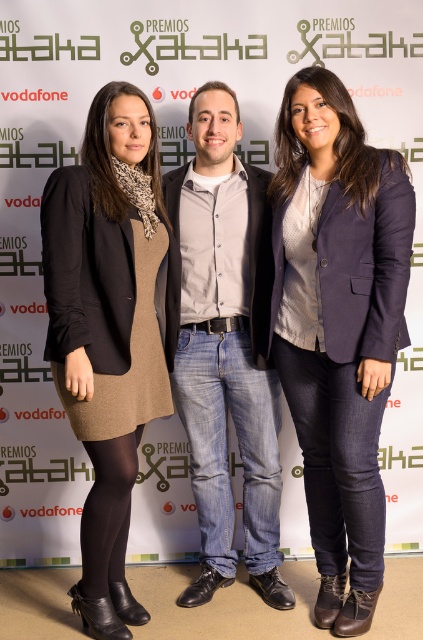
You are attending an awards ceremony and see two people wearing blazers. The first person is wearing a matte black blazer at left, and the second is wearing a navy blue blazer at center. Based on their positions, which blazer is located to the right?

The navy blue blazer at center is positioned on the right side of the matte black blazer at left, so the navy blue blazer at center is located to the right.

You are a photographer setting up for a group photo. You need to ensure that the matte black blazer at left and the denim jeans at center are both in focus. Since you can only focus on one object, which one should you choose to ensure the other is also in focus?

The matte black blazer at left is closer to the viewer than the denim jeans at center. To ensure both are in focus, you should focus on the matte black blazer at left because it is closer, and the depth of field will extend to the denim jeans at center.